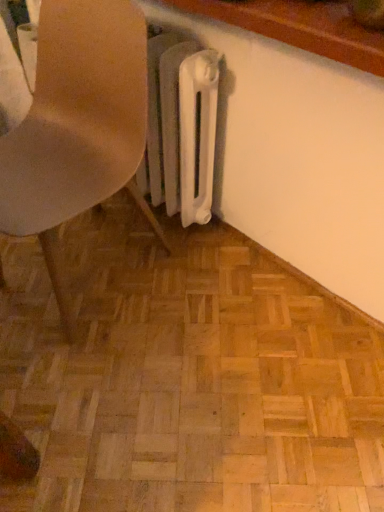
Question: Is matte plastic chair at lower left inside or outside of natural wood parquet floor at center?

Choices:
 (A) inside
 (B) outside

Answer: (B)

Question: Visually, is matte plastic chair at lower left positioned to the left or to the right of natural wood parquet floor at center?

Choices:
 (A) right
 (B) left

Answer: (B)

Question: Relative to natural wood parquet floor at center, is matte plastic chair at lower left in front or behind?

Choices:
 (A) behind
 (B) front

Answer: (B)

Question: Is natural wood parquet floor at center to the left or to the right of matte plastic chair at lower left in the image?

Choices:
 (A) right
 (B) left

Answer: (A)

Question: Is natural wood parquet floor at center in front of or behind matte plastic chair at lower left in the image?

Choices:
 (A) front
 (B) behind

Answer: (B)

Question: Is point (14, 295) closer or farther from the camera than point (57, 113)?

Choices:
 (A) farther
 (B) closer

Answer: (A)

Question: In terms of width, does natural wood parquet floor at center look wider or thinner when compared to matte plastic chair at lower left?

Choices:
 (A) wide
 (B) thin

Answer: (A)